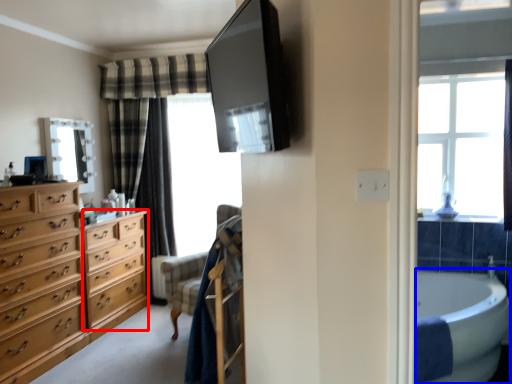
Question: Which of the following is the closest to the observer, cabinetry (highlighted by a red box) or bath (highlighted by a blue box)?

Choices:
 (A) cabinetry
 (B) bath

Answer: (B)